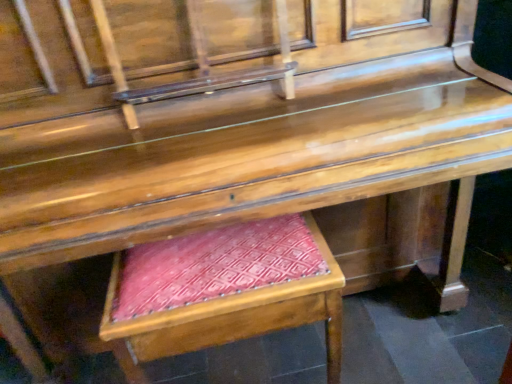
What do you see at coordinates (222, 291) in the screenshot? I see `red leather stool at center` at bounding box center [222, 291].

I want to click on red leather stool at center, so click(222, 291).

At what (x,y) coordinates should I click in order to perform the action: click on red leather stool at center. Please return your answer as a coordinate pair (x, y). This screenshot has width=512, height=384. Looking at the image, I should click on (222, 291).